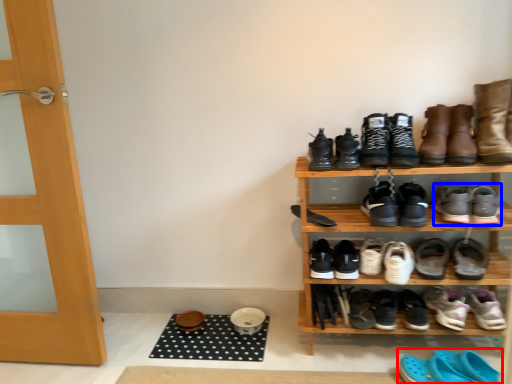
Question: Which object appears farthest to the camera in this image, footwear (highlighted by a red box) or footwear (highlighted by a blue box)?

Choices:
 (A) footwear
 (B) footwear

Answer: (B)